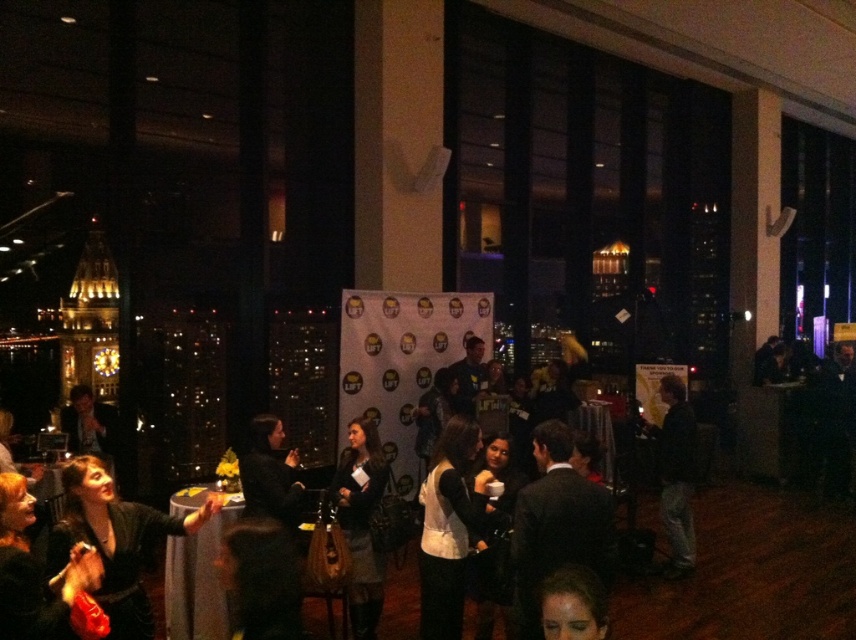
Consider the image. You are an event organizer and need to locate the velvet black dress at lower left. According to the coordinates provided, where exactly should you look in the image?

You should look at point 0.845 on the x axis and 0.136 on the y axis to find the velvet black dress at lower left.

From the picture: You are attending a formal event and notice two dresses in the crowd. The velvet black dress at lower left and the dark gray fabric dress at center. Which dress is covering part of the other one?

The velvet black dress at lower left is positioned over the dark gray fabric dress at center, so it is covering part of it.

You are organizing a charity event and need to ensure that all guests have enough space to move comfortably. You notice the velvet black dress at lower left and the dark gray suit at center. Which of these two items takes up more physical space in the scene?

The velvet black dress at lower left is bigger than the dark gray suit at center, so it takes up more physical space in the scene.